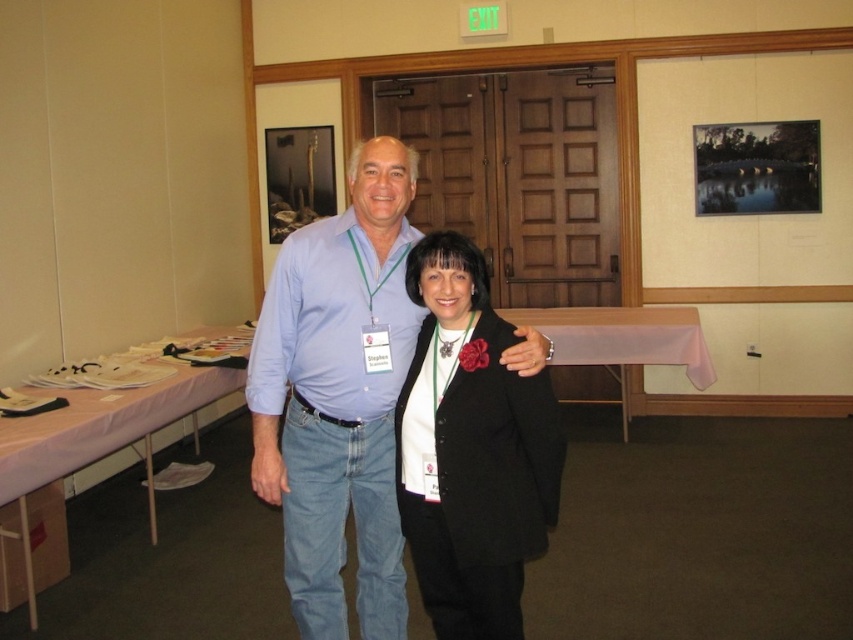
Question: Where is light blue cotton shirt at center located in relation to black woolen blazer at center in the image?

Choices:
 (A) above
 (B) below

Answer: (A)

Question: Can you confirm if light blue cotton shirt at center is bigger than black woolen blazer at center?

Choices:
 (A) no
 (B) yes

Answer: (B)

Question: Can you confirm if light blue cotton shirt at center is positioned above black woolen blazer at center?

Choices:
 (A) no
 (B) yes

Answer: (B)

Question: Which object appears closest to the camera in this image?

Choices:
 (A) black woolen blazer at center
 (B) light blue cotton shirt at center

Answer: (A)